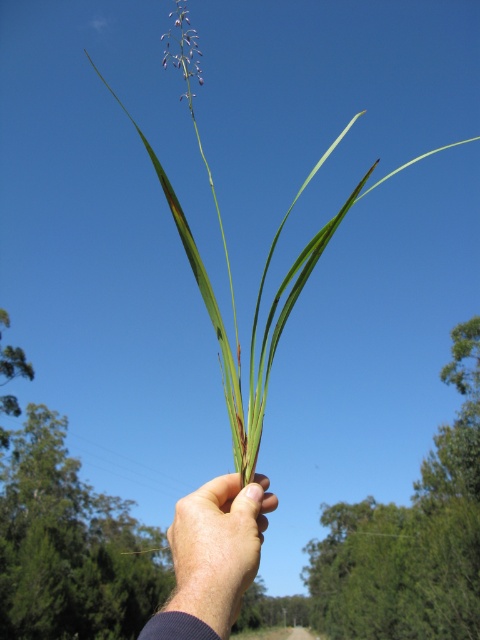
Question: Does skinny green leaf at center appear on the right side of purple matte flower at upper center?

Choices:
 (A) yes
 (B) no

Answer: (A)

Question: Which point appears closest to the camera in this image?

Choices:
 (A) (179, 22)
 (B) (201, 538)

Answer: (B)

Question: Which point is closer to the camera taking this photo?

Choices:
 (A) (175, 52)
 (B) (231, 570)

Answer: (B)

Question: Is skinny green leaf at center thinner than purple matte flower at upper center?

Choices:
 (A) yes
 (B) no

Answer: (A)

Question: Can you confirm if skinny green leaf at center is positioned below purple matte flower at upper center?

Choices:
 (A) yes
 (B) no

Answer: (A)